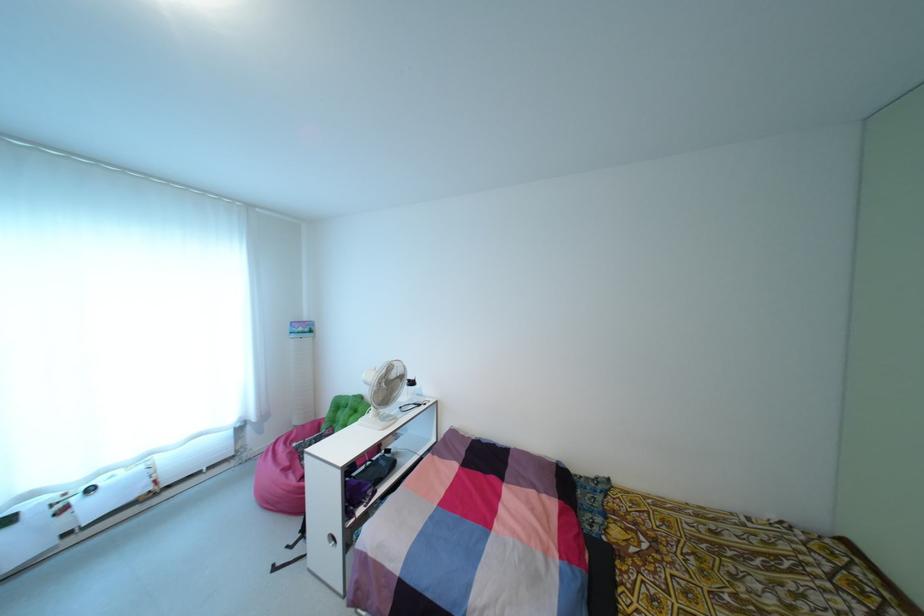
Image resolution: width=924 pixels, height=616 pixels. What do you see at coordinates (282, 464) in the screenshot?
I see `the chair sitting surface` at bounding box center [282, 464].